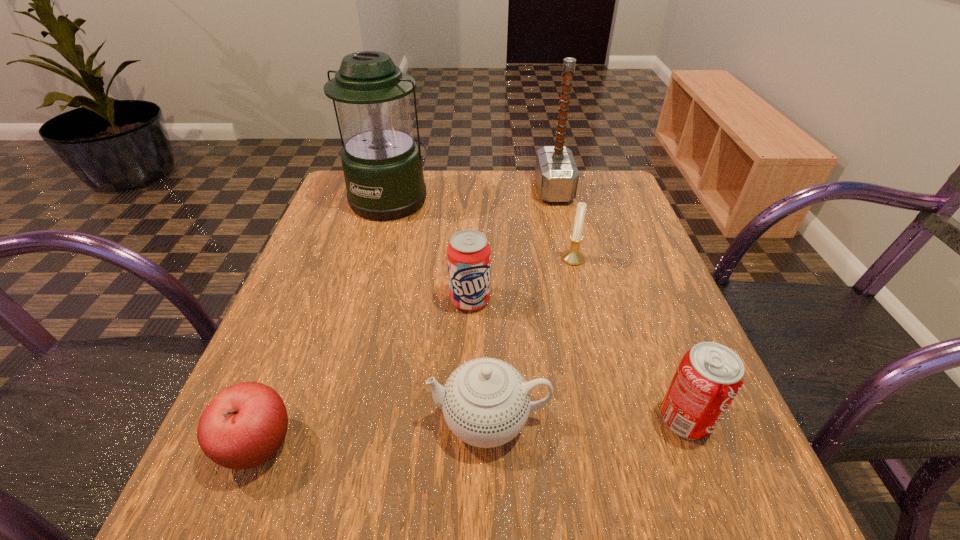
This screenshot has width=960, height=540. I want to click on vacant space located 0.160m on the striking surface of the hammer, so click(476, 190).

This screenshot has height=540, width=960. Find the location of `vacant space located 0.150m on the striking surface of the hammer`. vacant space located 0.150m on the striking surface of the hammer is located at coordinates (480, 190).

Find the location of a particular element. Image resolution: width=960 pixels, height=540 pixels. vacant space located on the striking surface of the hammer is located at coordinates (468, 190).

The height and width of the screenshot is (540, 960). In order to click on free region located 0.230m on the surface of the left soda can in this screenshot , I will do `click(467, 426)`.

The width and height of the screenshot is (960, 540). Identify the location of vacant region located 0.280m on the back of the candle holder. (555, 186).

Identify the location of free space located on the left of the rightmost object. (503, 418).

The height and width of the screenshot is (540, 960). In order to click on vacant space located 0.170m on the spout of the chinaware in this screenshot , I will do `click(319, 419)`.

This screenshot has width=960, height=540. I want to click on free region located 0.080m on the spout of the chinaware, so click(x=378, y=419).

I want to click on vacant space positioned 0.150m on the spout of the chinaware, so click(332, 419).

This screenshot has height=540, width=960. In order to click on free point located 0.110m on the right of the apple in this screenshot , I will do `click(372, 446)`.